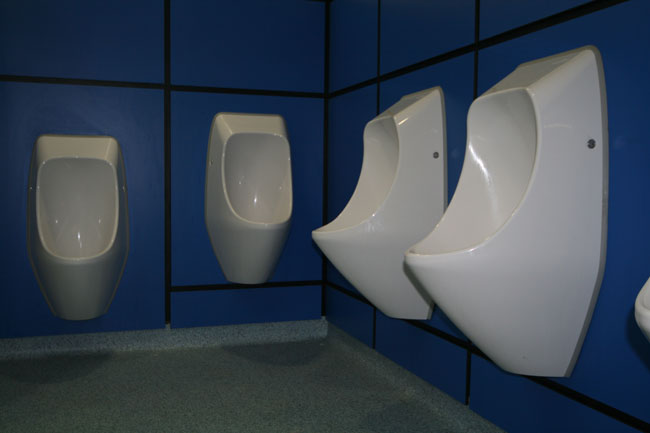
Locate an element on the screen. front lip of urinal is located at coordinates click(x=73, y=262), click(x=268, y=225), click(x=320, y=235), click(x=413, y=257), click(x=644, y=317).